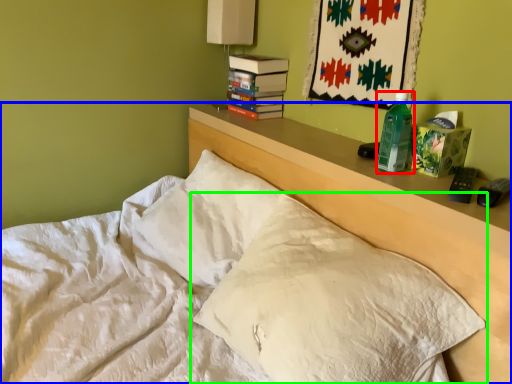
Question: Estimate the real-world distances between objects in this image. Which object is closer to bottle (highlighted by a red box), bed (highlighted by a blue box) or pillow (highlighted by a green box)?

Choices:
 (A) bed
 (B) pillow

Answer: (A)